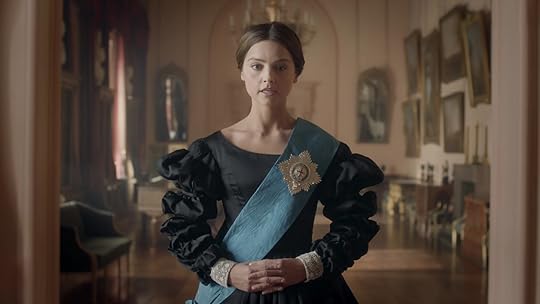
Identify the location of paintings. This screenshot has width=540, height=304. (447, 108), (427, 60).